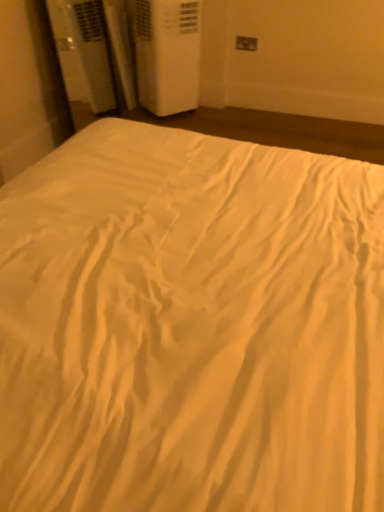
Question: Should I look upward or downward to see matte white electric outlet at upper right?

Choices:
 (A) down
 (B) up

Answer: (B)

Question: From a real-world perspective, is white plastic air conditioner at upper left under matte white electric outlet at upper right?

Choices:
 (A) yes
 (B) no

Answer: (A)

Question: Is white plastic air conditioner at upper left not inside matte white electric outlet at upper right?

Choices:
 (A) yes
 (B) no

Answer: (A)

Question: Would you say white plastic air conditioner at upper left contains matte white electric outlet at upper right?

Choices:
 (A) yes
 (B) no

Answer: (B)

Question: Are white plastic air conditioner at upper left and matte white electric outlet at upper right far apart?

Choices:
 (A) no
 (B) yes

Answer: (A)

Question: Is white plastic air conditioner at upper left further to camera compared to matte white electric outlet at upper right?

Choices:
 (A) yes
 (B) no

Answer: (B)

Question: From the image's perspective, would you say white plastic air conditioner at upper left is shown under matte white electric outlet at upper right?

Choices:
 (A) no
 (B) yes

Answer: (B)

Question: Is matte white electric outlet at upper right next to white plastic air conditioner at upper left?

Choices:
 (A) no
 (B) yes

Answer: (A)

Question: Considering the relative sizes of matte white electric outlet at upper right and white plastic air conditioner at upper left in the image provided, is matte white electric outlet at upper right thinner than white plastic air conditioner at upper left?

Choices:
 (A) yes
 (B) no

Answer: (A)

Question: Is matte white electric outlet at upper right wider than white plastic air conditioner at upper left?

Choices:
 (A) yes
 (B) no

Answer: (B)

Question: From a real-world perspective, is matte white electric outlet at upper right below white plastic air conditioner at upper left?

Choices:
 (A) yes
 (B) no

Answer: (B)

Question: Considering the relative sizes of matte white electric outlet at upper right and white plastic air conditioner at upper left in the image provided, is matte white electric outlet at upper right smaller than white plastic air conditioner at upper left?

Choices:
 (A) yes
 (B) no

Answer: (A)

Question: Is white plastic air conditioner at upper left a part of matte white electric outlet at upper right?

Choices:
 (A) no
 (B) yes

Answer: (A)

Question: Considering the positions of matte white electric outlet at upper right and white plastic air conditioner at upper left in the image, is matte white electric outlet at upper right bigger or smaller than white plastic air conditioner at upper left?

Choices:
 (A) big
 (B) small

Answer: (B)